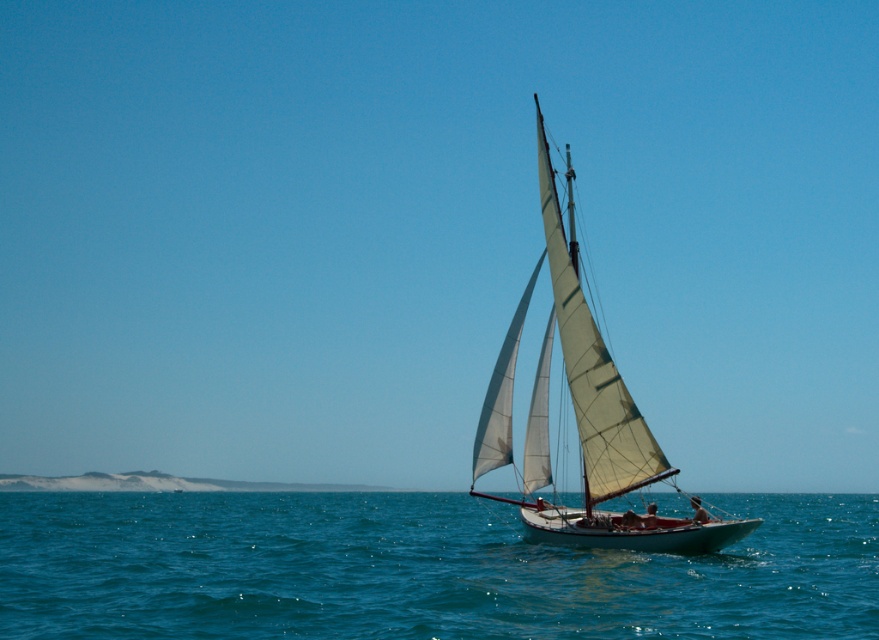
Question: Is blue water at center closer to camera compared to white canvas sail at center?

Choices:
 (A) no
 (B) yes

Answer: (B)

Question: Does blue water at center appear on the left side of white canvas sail at center?

Choices:
 (A) yes
 (B) no

Answer: (A)

Question: Observing the image, what is the correct spatial positioning of blue water at center in reference to white canvas sail at center?

Choices:
 (A) right
 (B) left

Answer: (B)

Question: Which point appears farthest from the camera in this image?

Choices:
 (A) (491, 460)
 (B) (288, 563)

Answer: (B)